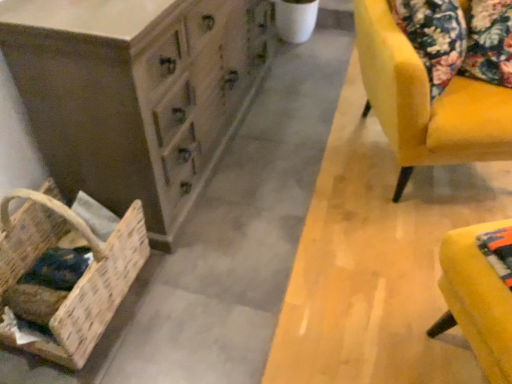
The image size is (512, 384). Identify the location of woven wood basket at lower left. (63, 276).

This screenshot has height=384, width=512. What do you see at coordinates (135, 93) in the screenshot? I see `wooden chest of drawers at lower left` at bounding box center [135, 93].

You are a GUI agent. You are given a task and a screenshot of the screen. Output one action in this format:
    pyautogui.click(x=<x>, y=<y>)
    Task: Click on the woven wood basket at lower left
    Image resolution: width=512 pixels, height=384 pixels.
    Given the screenshot: What is the action you would take?
    pyautogui.click(x=63, y=276)

Is woven wood basket at lower left placed right next to velvet yellow chair at right?

No, woven wood basket at lower left is not with velvet yellow chair at right.

Is woven wood basket at lower left smaller than velvet yellow chair at right?

Yes.

Does woven wood basket at lower left come in front of velvet yellow chair at right?

Yes, woven wood basket at lower left is closer to the viewer.

How many degrees apart are the facing directions of woven wood basket at lower left and velvet yellow chair at right?

The angular difference between woven wood basket at lower left and velvet yellow chair at right is 67.5 degrees.

Does velvet yellow chair at right appear on the left side of yellow fabric ottoman at lower right?

No.

Which is in front, velvet yellow chair at right or yellow fabric ottoman at lower right?

Positioned in front is yellow fabric ottoman at lower right.

From the image's perspective, which one is positioned higher, velvet yellow chair at right or yellow fabric ottoman at lower right?

velvet yellow chair at right, from the image's perspective.

Measure the distance between velvet yellow chair at right and yellow fabric ottoman at lower right.

velvet yellow chair at right is 24.41 inches from yellow fabric ottoman at lower right.

In the scene shown: Could you tell me if yellow fabric ottoman at lower right is turned towards woven wood basket at lower left?

No, yellow fabric ottoman at lower right is not oriented towards woven wood basket at lower left.

Does point (450, 247) appear closer or farther from the camera than point (76, 342)?

Clearly, point (450, 247) is closer to the camera than point (76, 342).

Is yellow fabric ottoman at lower right not close to woven wood basket at lower left?

Yes.

Considering the sizes of objects yellow fabric ottoman at lower right and woven wood basket at lower left in the image provided, who is shorter, yellow fabric ottoman at lower right or woven wood basket at lower left?

Standing shorter between the two is yellow fabric ottoman at lower right.

Can you confirm if yellow fabric ottoman at lower right is positioned to the left of velvet yellow chair at right?

Yes.

From a real-world perspective, is yellow fabric ottoman at lower right on top of velvet yellow chair at right?

No.

Is yellow fabric ottoman at lower right oriented towards velvet yellow chair at right?

No, yellow fabric ottoman at lower right is not oriented towards velvet yellow chair at right.

Considering the positions of points (493, 251) and (401, 151), is point (493, 251) farther from camera compared to point (401, 151)?

No, it is in front of (401, 151).

Considering the relative sizes of woven wood basket at lower left and wooden chest of drawers at lower left in the image provided, is woven wood basket at lower left shorter than wooden chest of drawers at lower left?

Correct, woven wood basket at lower left is not as tall as wooden chest of drawers at lower left.

Which point is more forward, [101,273] or [50,85]?

The point [50,85] is closer to the camera.

Based on the photo, can you confirm if woven wood basket at lower left is bigger than wooden chest of drawers at lower left?

No, woven wood basket at lower left is not bigger than wooden chest of drawers at lower left.

From a real-world perspective, is woven wood basket at lower left below wooden chest of drawers at lower left?

Yes, from a real-world perspective, woven wood basket at lower left is beneath wooden chest of drawers at lower left.

Between wooden chest of drawers at lower left and woven wood basket at lower left, which one appears on the right side from the viewer's perspective?

wooden chest of drawers at lower left.

From the image's perspective, which is below, wooden chest of drawers at lower left or woven wood basket at lower left?

From the image's view, woven wood basket at lower left is below.

Considering the positions of points (76, 152) and (30, 279), is point (76, 152) closer to camera compared to point (30, 279)?

Yes.

Which of these two, wooden chest of drawers at lower left or woven wood basket at lower left, is thinner?

Thinner between the two is woven wood basket at lower left.

Is velvet yellow chair at right wider or thinner than woven wood basket at lower left?

In the image, velvet yellow chair at right appears to be wider than woven wood basket at lower left.

Is velvet yellow chair at right at the left side of woven wood basket at lower left?

Incorrect, velvet yellow chair at right is not on the left side of woven wood basket at lower left.

Is point (498, 134) closer or farther from the camera than point (127, 260)?

Point (498, 134) is positioned farther from the camera compared to point (127, 260).

Looking at the image, does velvet yellow chair at right seem bigger or smaller compared to woven wood basket at lower left?

In the image, velvet yellow chair at right appears to be larger than woven wood basket at lower left.

Image resolution: width=512 pixels, height=384 pixels. I want to click on basket below the velvet yellow chair at right (from a real-world perspective), so click(63, 276).

Locate an element on the screen. The width and height of the screenshot is (512, 384). chair to the right of yellow fabric ottoman at lower right is located at coordinates (426, 102).

From the image, which object appears to be farther from yellow fabric ottoman at lower right, velvet yellow chair at right or woven wood basket at lower left?

woven wood basket at lower left lies further to yellow fabric ottoman at lower right than the other object.

When comparing their distances from velvet yellow chair at right, does wooden chest of drawers at lower left or yellow fabric ottoman at lower right seem further?

wooden chest of drawers at lower left is positioned further to the anchor velvet yellow chair at right.

When comparing their distances from woven wood basket at lower left, does velvet yellow chair at right or wooden chest of drawers at lower left seem closer?

wooden chest of drawers at lower left is positioned closer to the anchor woven wood basket at lower left.

Based on their spatial positions, is woven wood basket at lower left or wooden chest of drawers at lower left further from velvet yellow chair at right?

woven wood basket at lower left lies further to velvet yellow chair at right than the other object.

Considering their positions, is velvet yellow chair at right positioned further to woven wood basket at lower left than yellow fabric ottoman at lower right?

velvet yellow chair at right lies further to woven wood basket at lower left than the other object.

Looking at this image, from the image, which object appears to be nearer to woven wood basket at lower left, yellow fabric ottoman at lower right or velvet yellow chair at right?

Based on the image, yellow fabric ottoman at lower right appears to be nearer to woven wood basket at lower left.

Considering their positions, is yellow fabric ottoman at lower right positioned further to velvet yellow chair at right than wooden chest of drawers at lower left?

wooden chest of drawers at lower left.

From the image, which object appears to be farther from yellow fabric ottoman at lower right, wooden chest of drawers at lower left or woven wood basket at lower left?

woven wood basket at lower left is positioned further to the anchor yellow fabric ottoman at lower right.

Identify the location of furniture between wooden chest of drawers at lower left and velvet yellow chair at right. click(x=480, y=293).

Where is `furniture situated between woven wood basket at lower left and velvet yellow chair at right from left to right`? furniture situated between woven wood basket at lower left and velvet yellow chair at right from left to right is located at coordinates (480, 293).

The width and height of the screenshot is (512, 384). I want to click on the chest of drawers situated between woven wood basket at lower left and yellow fabric ottoman at lower right from left to right, so click(135, 93).

The height and width of the screenshot is (384, 512). I want to click on the chest of drawers located between woven wood basket at lower left and velvet yellow chair at right in the left-right direction, so click(x=135, y=93).